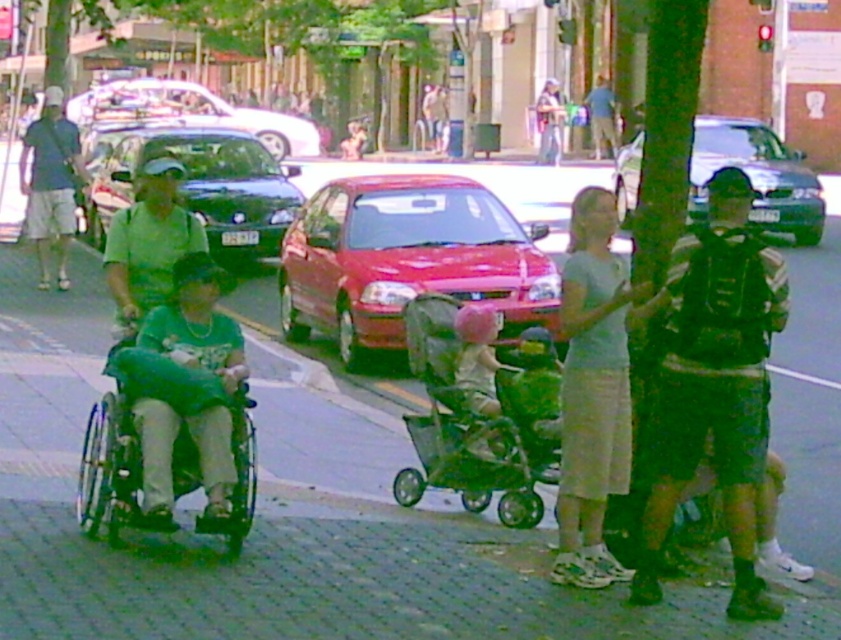
Does shiny red car at center appear over blue denim shirt at upper center?

Actually, shiny red car at center is below blue denim shirt at upper center.

Measure the distance between point [448,278] and camera.

Point [448,278] and camera are 11.14 meters apart from each other.

What are the coordinates of `shiny red car at center` in the screenshot? It's located at (405, 259).

Is point (511, 259) farther from viewer compared to point (138, 180)?

That is True.

Does shiny red car at center have a larger size compared to green matte shirt at center?

Yes.

Between point (498, 272) and point (161, 172), which one is positioned behind?

Positioned behind is point (498, 272).

Find the location of `shiny red car at center`. shiny red car at center is located at coordinates (405, 259).

Is point (315, 248) positioned in front of point (746, 125)?

Yes, it is.

Does shiny red car at center have a smaller size compared to metallic silver sedan at center?

Yes.

Where is `shiny red car at center`? The width and height of the screenshot is (841, 640). shiny red car at center is located at coordinates (405, 259).